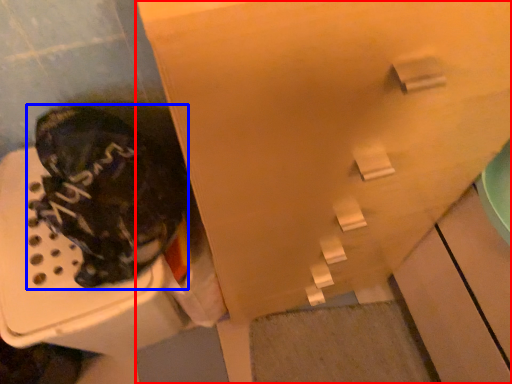
Question: Which object appears farthest to the camera in this image, cabinetry (highlighted by a red box) or footwear (highlighted by a blue box)?

Choices:
 (A) cabinetry
 (B) footwear

Answer: (B)